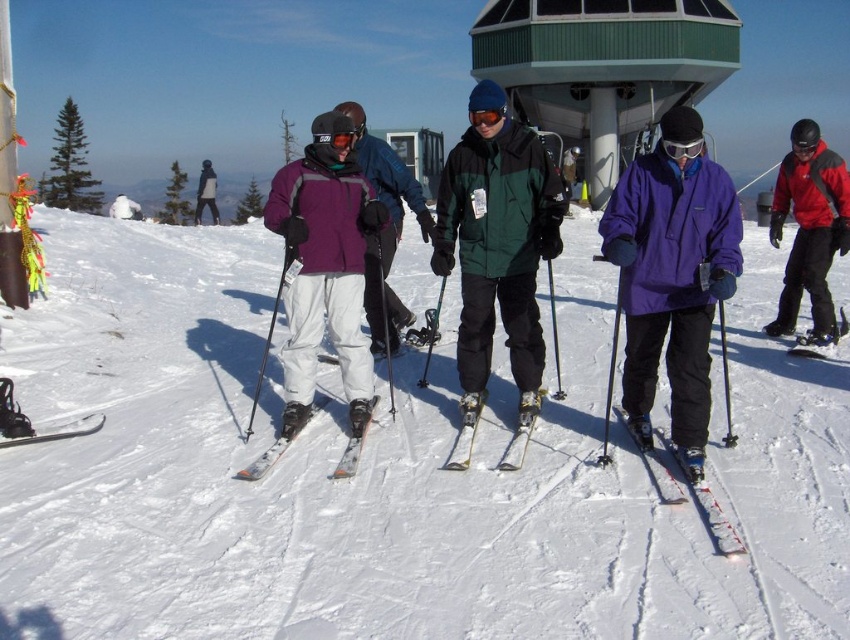
Question: Which of the following is the farthest from the observer?

Choices:
 (A) matte black jacket at upper left
 (B) red matte jacket at right
 (C) green matte jacket at center
 (D) red skis at center

Answer: (A)

Question: Which object is the farthest from the yellow metallic ski at center?

Choices:
 (A) red matte jacket at right
 (B) orange metallic skis at center

Answer: (A)

Question: Considering the relative positions of matte black ski at lower left and matte black jacket at upper left in the image provided, where is matte black ski at lower left located with respect to matte black jacket at upper left?

Choices:
 (A) right
 (B) left

Answer: (A)

Question: Observing the image, what is the correct spatial positioning of green matte jacket at center in reference to red skis at center?

Choices:
 (A) above
 (B) below

Answer: (A)

Question: Which object is the closest to the matte purple jacket at center?

Choices:
 (A) matte black ski at lower left
 (B) white snow at center
 (C) red skis at center
 (D) green matte jacket at center

Answer: (D)

Question: Can you confirm if white snow at center is positioned above matte purple jacket at center?

Choices:
 (A) no
 (B) yes

Answer: (A)